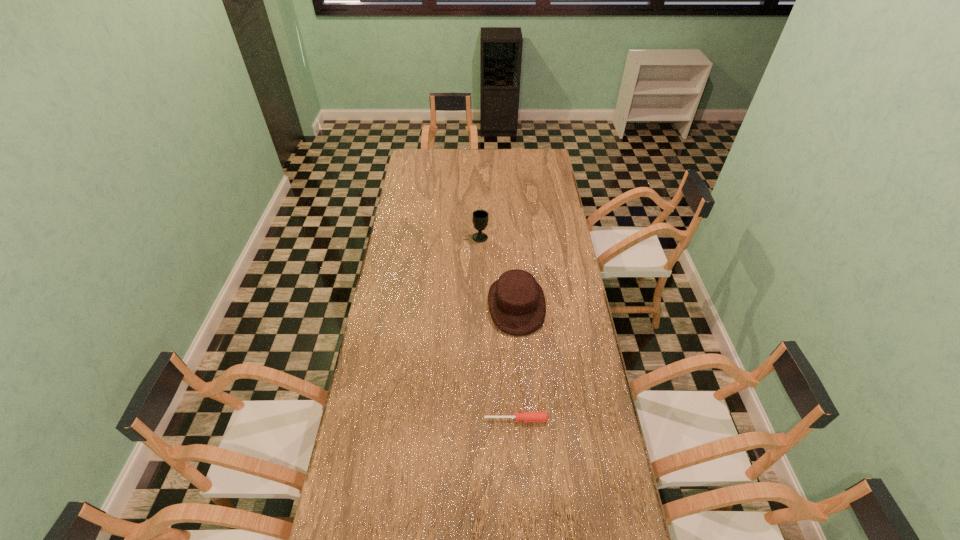
The height and width of the screenshot is (540, 960). I want to click on free region that satisfies the following two spatial constraints: 1. on the back side of the shortest object; 2. on the left side of the second farthest object, so click(x=510, y=305).